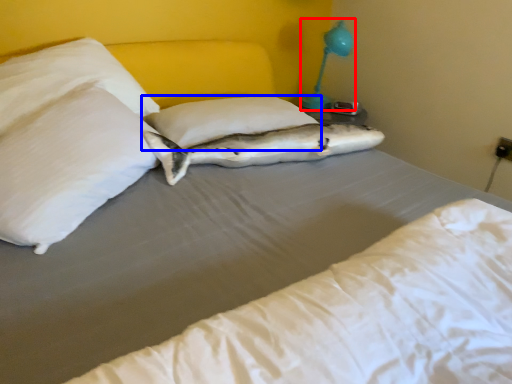
Question: Which of the following is the farthest to the observer, bedside lamp (highlighted by a red box) or pillow (highlighted by a blue box)?

Choices:
 (A) bedside lamp
 (B) pillow

Answer: (A)